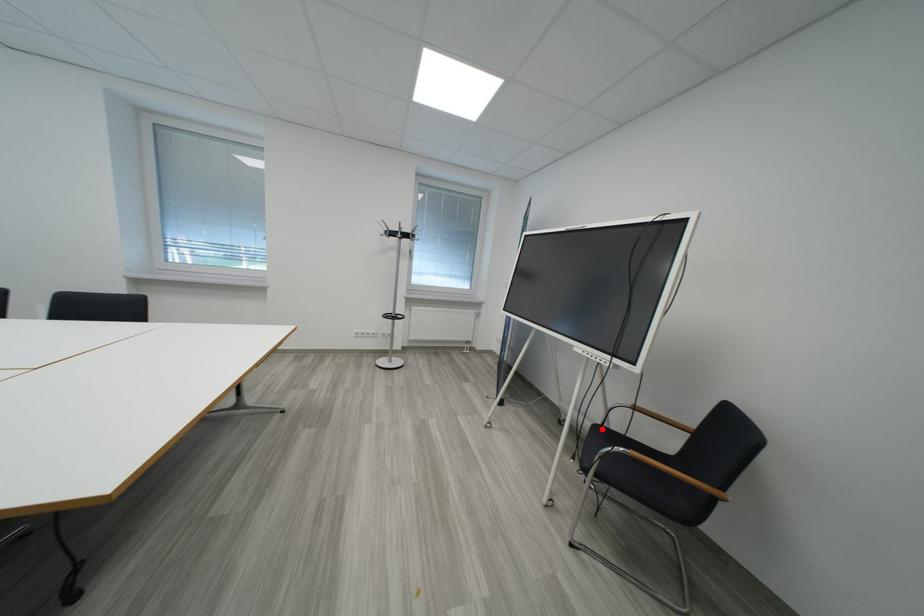
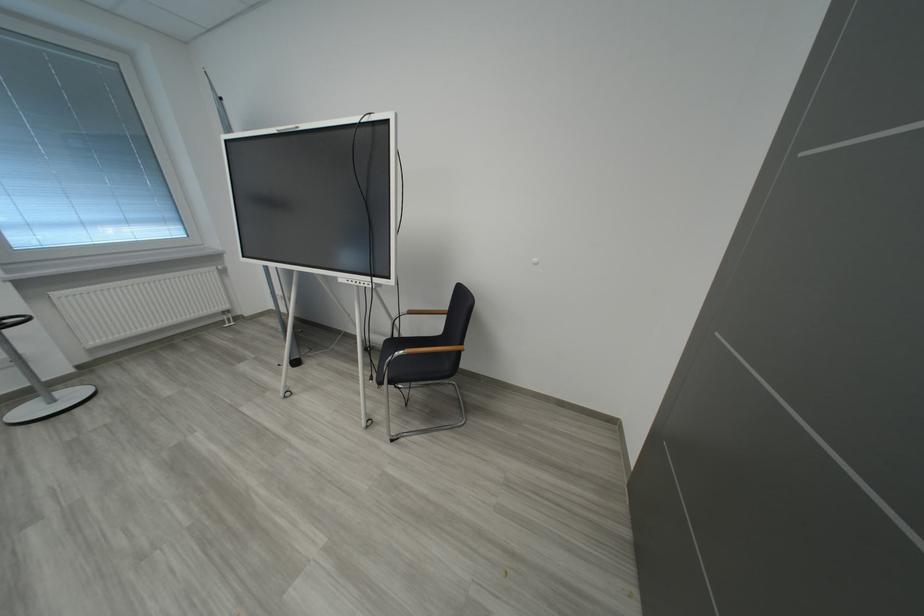
In the second image, find the point that corresponds to the highlighted location in the first image.

(394, 344)